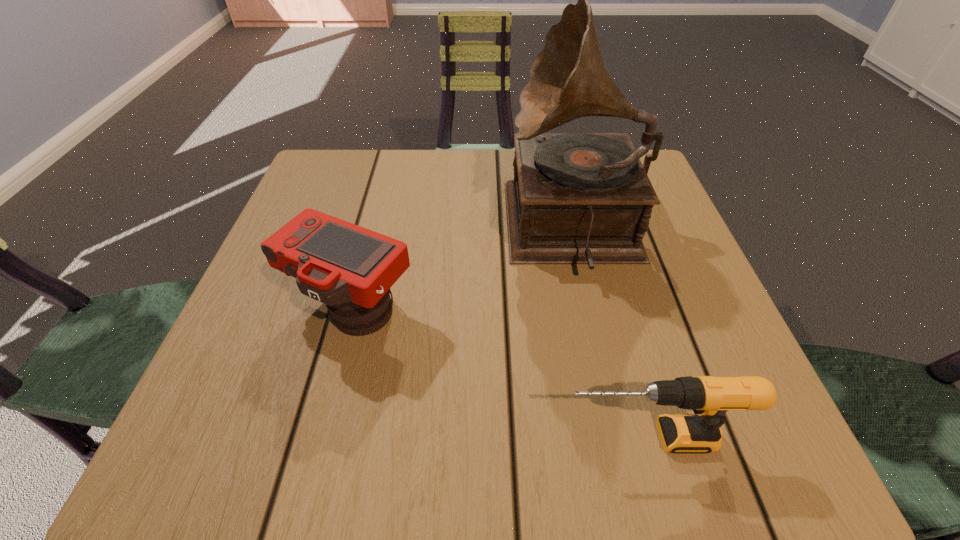
You are a GUI agent. You are given a task and a screenshot of the screen. Output one action in this format:
    pyautogui.click(x=<x>, y=<y>)
    Task: Click on the object that is at the far edge
    The width and height of the screenshot is (960, 540).
    Given the screenshot: What is the action you would take?
    pyautogui.click(x=577, y=198)

Locate an element on the screen. This screenshot has height=540, width=960. object that is at the near edge is located at coordinates (711, 397).

The height and width of the screenshot is (540, 960). Identify the location of object that is positioned at the left edge. (350, 269).

You are a GUI agent. You are given a task and a screenshot of the screen. Output one action in this format:
    pyautogui.click(x=<x>, y=<y>)
    Task: Click on the record player that is at the right edge
    
    Given the screenshot: What is the action you would take?
    pyautogui.click(x=577, y=198)

The width and height of the screenshot is (960, 540). Find the location of `drill situated at the right edge`. drill situated at the right edge is located at coordinates (711, 397).

Find the location of a particular element. object positioned at the far right corner is located at coordinates (577, 198).

At what (x,y) coordinates should I click in order to perform the action: click on object located in the near right corner section of the desktop. Please return your answer as a coordinate pair (x, y). Image resolution: width=960 pixels, height=540 pixels. Looking at the image, I should click on (711, 397).

Where is `vacant space at the far edge of the desktop`? The width and height of the screenshot is (960, 540). vacant space at the far edge of the desktop is located at coordinates (491, 190).

Locate an element on the screen. The height and width of the screenshot is (540, 960). vacant space at the near edge is located at coordinates (562, 462).

Locate an element on the screen. free space at the left edge of the desktop is located at coordinates (303, 309).